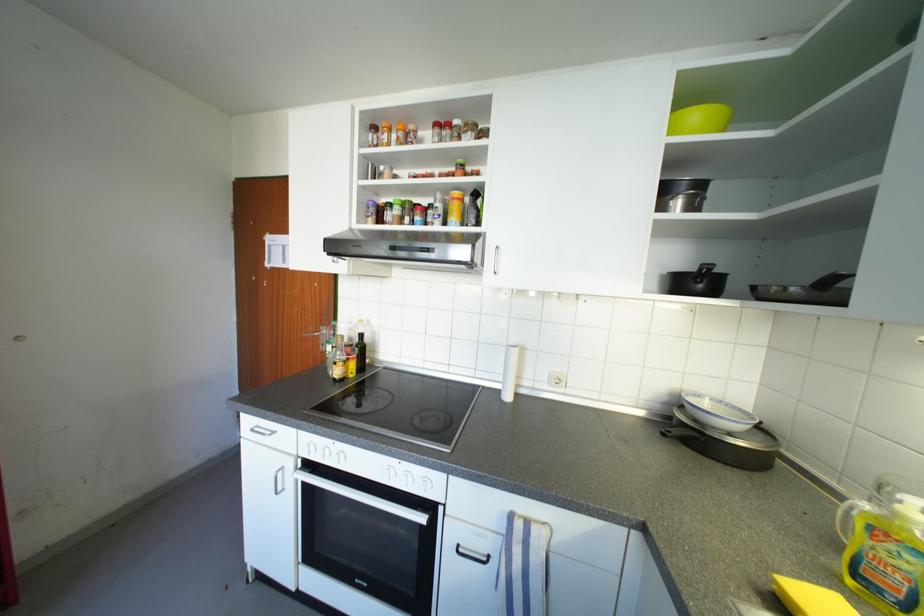
What are the coordinates of `silver drawer handle` in the screenshot? It's located at (261, 430).